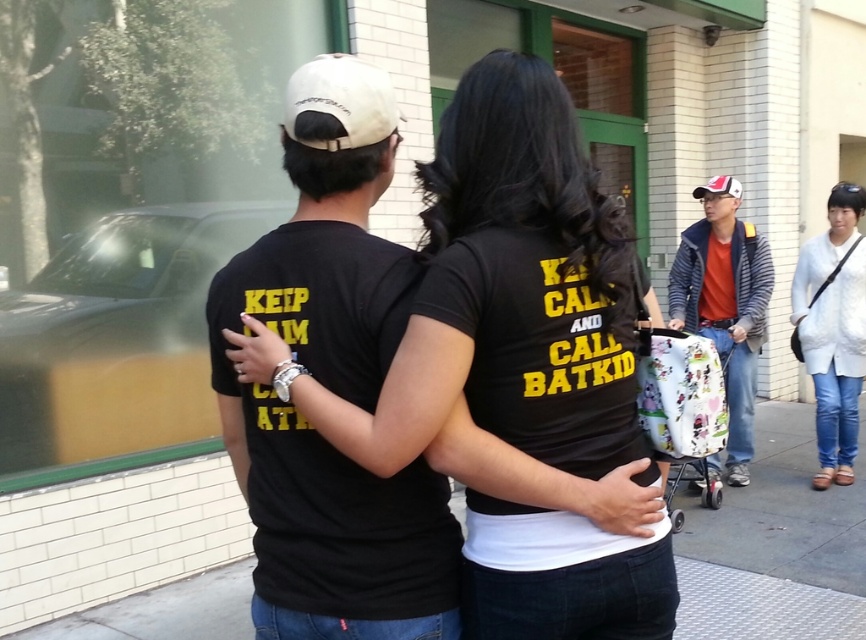
Looking at this image, is gray concrete sidewalk at center smaller than white cotton shirt at center?

Indeed, gray concrete sidewalk at center has a smaller size compared to white cotton shirt at center.

Measure the distance between gray concrete sidewalk at center and white cotton shirt at center.

1.16 meters

Describe the element at coordinates (776, 536) in the screenshot. I see `gray concrete sidewalk at center` at that location.

Where is `gray concrete sidewalk at center`? gray concrete sidewalk at center is located at coordinates (776, 536).

Is black matte shirt at center closer to camera compared to white cotton shirt at center?

Yes, it is.

Who is higher up, black matte shirt at center or white cotton shirt at center?

Positioned higher is black matte shirt at center.

Does point (583, 552) come closer to viewer compared to point (813, 291)?

Yes, point (583, 552) is in front of point (813, 291).

Find the location of `black matte shirt at center`. black matte shirt at center is located at coordinates (534, 269).

From the picture: Measure the distance from black matte t-shirt at center to gray concrete sidewalk at center.

9.84 feet

Who is more distant from viewer, [308,515] or [696,557]?

The point [696,557] is more distant.

Image resolution: width=866 pixels, height=640 pixels. Identify the location of black matte t-shirt at center. (333, 385).